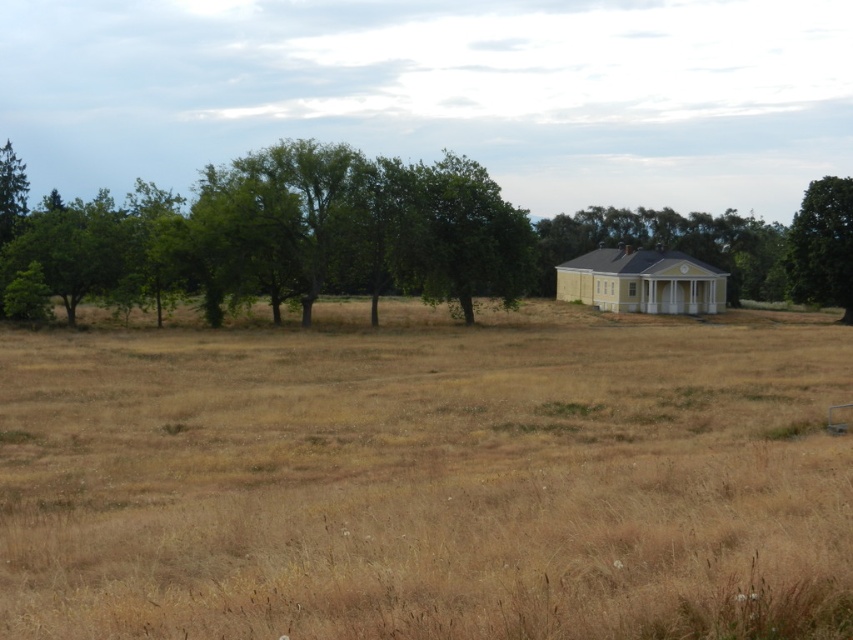
You are a photographer planning to take a landscape photo of the yellow painted wood house at center and the green leafy tree at right. Based on their sizes, which object should you focus on first to ensure both are in frame?

The yellow painted wood house at center is bigger than the green leafy tree at right, so you should focus on the yellow painted wood house at center first to ensure both fit in the frame.

You are a farmer standing at the edge of the field. You need to reach the green leafy tree at right to collect some leaves. Can you walk directly towards it from your current position without stepping on the dry grass at center?

The dry grass at center is located below the green leafy tree at right, which means the tree is positioned above the grass in the image. Since you are standing at the edge of the field, you can walk directly towards the green leafy tree at right without stepping on the dry grass at center as the tree is in a higher position.